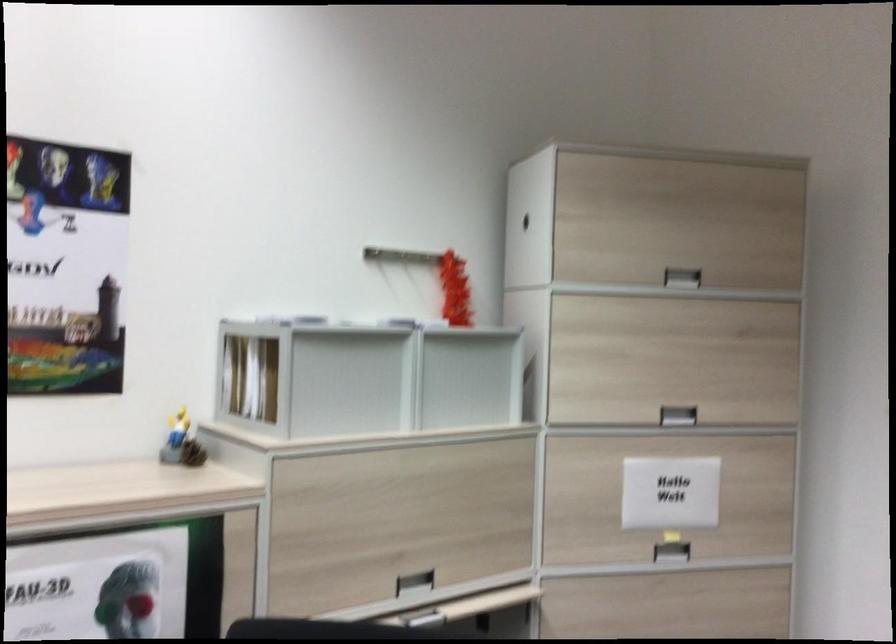
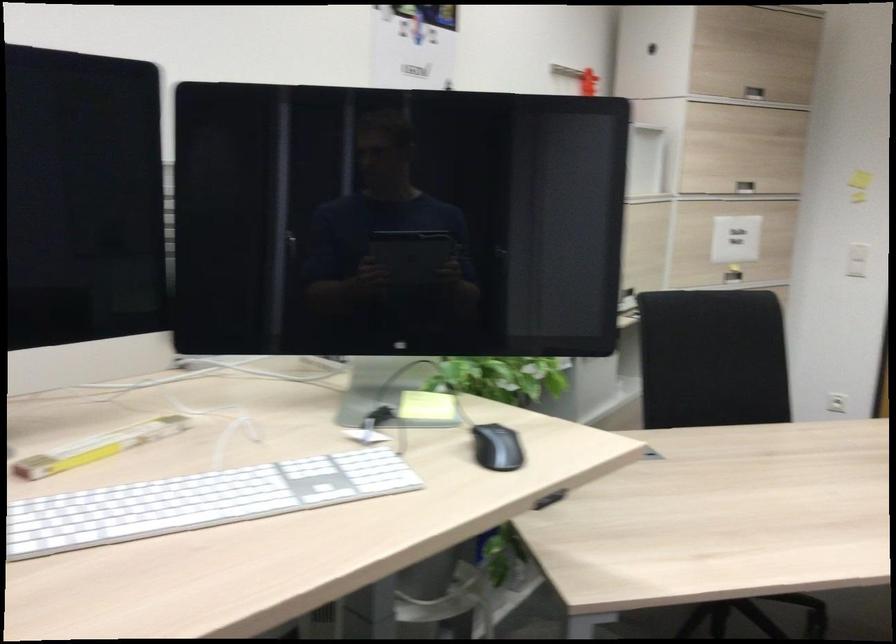
The point at (650,493) is marked in the first image. Where is the corresponding point in the second image?

(736, 239)